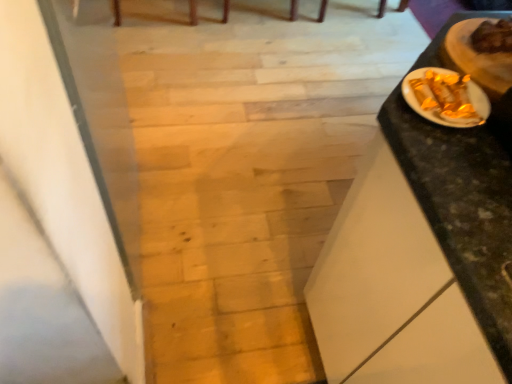
Question: Can you confirm if black marble table at right is taller than golden foil-wrapped food at upper right, acting as the first food starting from the top?

Choices:
 (A) no
 (B) yes

Answer: (B)

Question: Would you consider black marble table at right to be distant from golden foil-wrapped food at upper right, acting as the first food starting from the top?

Choices:
 (A) no
 (B) yes

Answer: (A)

Question: Is black marble table at right smaller than golden foil-wrapped food at upper right, which is counted as the 1th food, starting from the right?

Choices:
 (A) yes
 (B) no

Answer: (B)

Question: Can you confirm if black marble table at right is shorter than golden foil-wrapped food at upper right, placed as the second food when sorted from bottom to top?

Choices:
 (A) yes
 (B) no

Answer: (B)

Question: Is black marble table at right positioned beyond the bounds of golden foil-wrapped food at upper right, placed as the second food when sorted from bottom to top?

Choices:
 (A) yes
 (B) no

Answer: (A)

Question: From the image's perspective, is black marble table at right located beneath golden foil-wrapped food at upper right, which is counted as the 1th food, starting from the right?

Choices:
 (A) yes
 (B) no

Answer: (A)

Question: From a real-world perspective, is gold foil wrapped food at right positioned under golden foil-wrapped food at upper right, acting as the first food starting from the top, based on gravity?

Choices:
 (A) yes
 (B) no

Answer: (A)

Question: Is gold foil wrapped food at right positioned with its back to golden foil-wrapped food at upper right, acting as the first food starting from the top?

Choices:
 (A) yes
 (B) no

Answer: (B)

Question: Is gold foil wrapped food at right further to camera compared to golden foil-wrapped food at upper right, which is counted as the 1th food, starting from the right?

Choices:
 (A) yes
 (B) no

Answer: (B)

Question: Considering the relative sizes of gold foil wrapped food at right and golden foil-wrapped food at upper right, acting as the first food starting from the top, in the image provided, is gold foil wrapped food at right thinner than golden foil-wrapped food at upper right, acting as the first food starting from the top,?

Choices:
 (A) yes
 (B) no

Answer: (B)

Question: From the image's perspective, is gold foil wrapped food at right on golden foil-wrapped food at upper right, the second food positioned from the left?

Choices:
 (A) no
 (B) yes

Answer: (A)

Question: From the image's perspective, is gold foil wrapped food at right located beneath golden foil-wrapped food at upper right, which is counted as the 1th food, starting from the right?

Choices:
 (A) yes
 (B) no

Answer: (A)

Question: Can you confirm if gold foil wrapped food at right is shorter than gold foil candy at right, which ranks as the 1th food in left-to-right order?

Choices:
 (A) no
 (B) yes

Answer: (A)